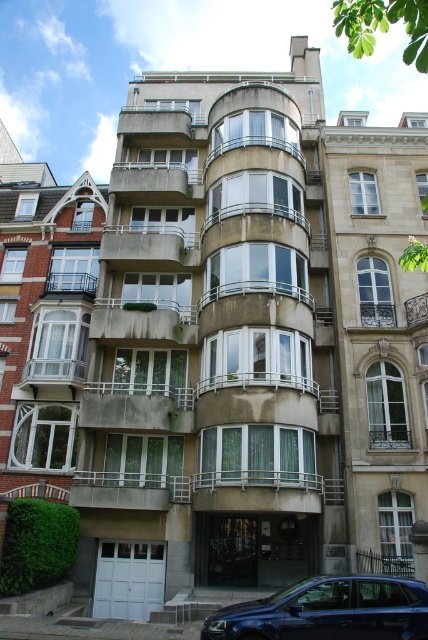
Who is positioned more to the right, white concrete balcony at center or concrete at center?

Positioned to the right is concrete at center.

Can you confirm if white concrete balcony at center is positioned above concrete at center?

No.

Who is more forward, (98, 397) or (160, 259)?

Point (98, 397) is more forward.

This screenshot has height=640, width=428. Identify the location of white concrete balcony at center. (136, 406).

Who is more forward, (125, 387) or (187, 481)?

Point (187, 481) is in front.

Can you confirm if white concrete balcony at center is positioned below concrete balcony at center?

Incorrect, white concrete balcony at center is not positioned below concrete balcony at center.

Where is `white concrete balcony at center`? This screenshot has height=640, width=428. white concrete balcony at center is located at coordinates (136, 406).

Locate an element on the screen. white concrete balcony at center is located at coordinates (136, 406).

Can you confirm if shiny blue sedan at lower center is thinner than concrete balcony at center?

No.

Can you confirm if shiny blue sedan at lower center is wider than concrete balcony at center?

Yes.

Where is `shiny blue sedan at lower center`? shiny blue sedan at lower center is located at coordinates (329, 611).